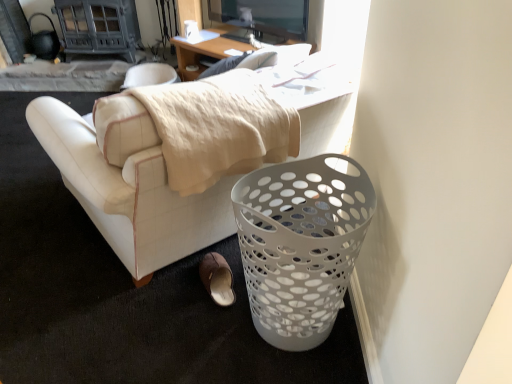
You are a GUI agent. You are given a task and a screenshot of the screen. Output one action in this format:
    pyautogui.click(x=<x>, y=<y>)
    Task: Click on the brown suede slipper at lower center
    The height and width of the screenshot is (384, 512).
    Given the screenshot: What is the action you would take?
    pyautogui.click(x=217, y=279)

Measure the distance between point (277, 317) and camera.

1.54 meters.

At what (x,y) coordinates should I click in order to perform the action: click on brown suede slipper at lower center. Please return your answer as a coordinate pair (x, y). This screenshot has width=512, height=384. Looking at the image, I should click on (217, 279).

From a real-world perspective, is white perforated trash bin at lower right physically located above or below white leather couch at center?

white perforated trash bin at lower right is below white leather couch at center.

Do you think white perforated trash bin at lower right is within white leather couch at center, or outside of it?

white perforated trash bin at lower right is spatially situated outside white leather couch at center.

Considering the sizes of objects white perforated trash bin at lower right and white leather couch at center in the image provided, who is bigger, white perforated trash bin at lower right or white leather couch at center?

white leather couch at center is bigger.

From their relative heights in the image, would you say white perforated trash bin at lower right is taller or shorter than white leather couch at center?

In the image, white perforated trash bin at lower right appears to be taller than white leather couch at center.

Are white leather couch at center and white perforated trash bin at lower right beside each other?

white leather couch at center is not next to white perforated trash bin at lower right, and they're not touching.

From a real-world perspective, is white leather couch at center physically located above or below white perforated trash bin at lower right?

Clearly, from a real-world perspective, white leather couch at center is above white perforated trash bin at lower right.

Which of these two, white leather couch at center or white perforated trash bin at lower right, stands shorter?

With less height is white leather couch at center.

Is white leather couch at center inside the boundaries of brown suede slipper at lower center, or outside?

→ white leather couch at center exists outside the volume of brown suede slipper at lower center.

Is the position of white leather couch at center less distant than that of brown suede slipper at lower center?

Yes, white leather couch at center is closer to the viewer.

Is white leather couch at center next to brown suede slipper at lower center?

No, white leather couch at center is not with brown suede slipper at lower center.

Between point (221, 280) and point (131, 237), which one is positioned in front?

Point (131, 237)

From a real-world perspective, which is physically above, brown suede slipper at lower center or white leather couch at center?

white leather couch at center, from a real-world perspective.

Which object is wider, brown suede slipper at lower center or white leather couch at center?

white leather couch at center is wider.

Is brown suede slipper at lower center taller or shorter than white leather couch at center?

brown suede slipper at lower center is shorter than white leather couch at center.

Locate an element on the screen. trash bin/can above the brown suede slipper at lower center (from a real-world perspective) is located at coordinates (300, 245).

Between brown suede slipper at lower center and white perforated trash bin at lower right, which one has smaller size?

Smaller between the two is brown suede slipper at lower center.

From the image's perspective, which is above, brown suede slipper at lower center or white perforated trash bin at lower right?

From the image's view, white perforated trash bin at lower right is above.

Is brown suede slipper at lower center aimed at white perforated trash bin at lower right?

No, brown suede slipper at lower center is not facing towards white perforated trash bin at lower right.

In order to click on trash bin/can above the brown suede slipper at lower center (from a real-world perspective) in this screenshot , I will do `click(300, 245)`.

Relative to brown suede slipper at lower center, is white perforated trash bin at lower right in front or behind?

white perforated trash bin at lower right is positioned closer to the viewer than brown suede slipper at lower center.

Can you confirm if white perforated trash bin at lower right is wider than brown suede slipper at lower center?

Yes.

Is point (349, 262) in front of point (220, 283)?

Yes, it is.

The height and width of the screenshot is (384, 512). Find the location of `studio couch above the white perforated trash bin at lower right (from a real-world perspective)`. studio couch above the white perforated trash bin at lower right (from a real-world perspective) is located at coordinates (129, 183).

Identify the location of trash bin/can below the white leather couch at center (from a real-world perspective). (300, 245).

When comparing their distances from brown suede slipper at lower center, does white perforated trash bin at lower right or white leather couch at center seem further?

white perforated trash bin at lower right.

Estimate the real-world distances between objects in this image. Which object is closer to white leather couch at center, brown suede slipper at lower center or white perforated trash bin at lower right?

white perforated trash bin at lower right.

Based on their spatial positions, is white leather couch at center or brown suede slipper at lower center closer to white perforated trash bin at lower right?

Among the two, white leather couch at center is located nearer to white perforated trash bin at lower right.

Looking at the image, which one is located further to white perforated trash bin at lower right, brown suede slipper at lower center or white leather couch at center?

brown suede slipper at lower center.

From the picture: Estimate the real-world distances between objects in this image. Which object is closer to white leather couch at center, white perforated trash bin at lower right or brown suede slipper at lower center?

The object closer to white leather couch at center is white perforated trash bin at lower right.

Estimate the real-world distances between objects in this image. Which object is closer to brown suede slipper at lower center, white leather couch at center or white perforated trash bin at lower right?

white leather couch at center.

This screenshot has height=384, width=512. What are the coordinates of `trash bin/can between white leather couch at center and brown suede slipper at lower center in the front-back direction` in the screenshot? It's located at (300, 245).